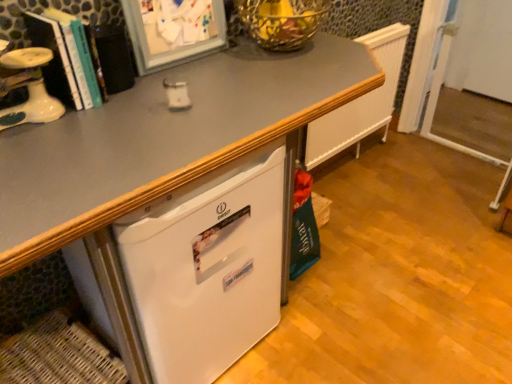
Find the location of a particular element. The height and width of the screenshot is (384, 512). free spot below white textured radiator at upper right (from a real-world perspective) is located at coordinates (342, 163).